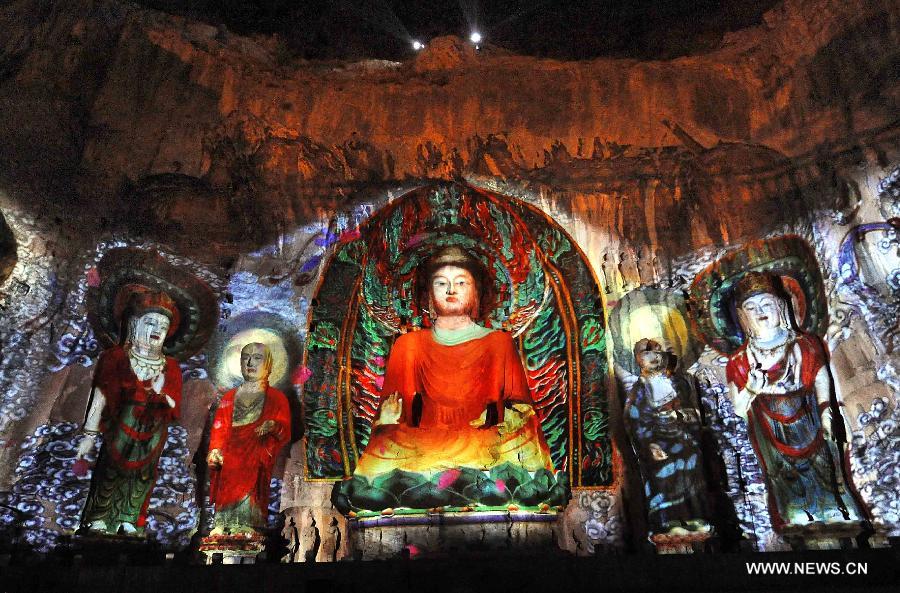
Locate an element on the screen. This screenshot has width=900, height=593. sculptures is located at coordinates (727, 261), (505, 283), (136, 309).